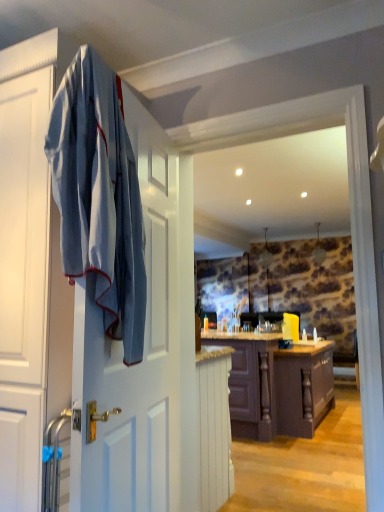
Question: Is white painted wood cabinet at lower center, the first cabinetry when ordered from left to right, facing away from blue cotton bath towel at left?

Choices:
 (A) yes
 (B) no

Answer: (B)

Question: Can you confirm if white painted wood cabinet at lower center, the 1th cabinetry from the front, is smaller than blue cotton bath towel at left?

Choices:
 (A) yes
 (B) no

Answer: (B)

Question: Does white painted wood cabinet at lower center, the 1th cabinetry from the front, have a greater width compared to blue cotton bath towel at left?

Choices:
 (A) no
 (B) yes

Answer: (A)

Question: Does white painted wood cabinet at lower center, arranged as the 2th cabinetry when viewed from the back, lie behind blue cotton bath towel at left?

Choices:
 (A) no
 (B) yes

Answer: (B)

Question: Is white painted wood cabinet at lower center, the 1th cabinetry from the front, in contact with blue cotton bath towel at left?

Choices:
 (A) no
 (B) yes

Answer: (A)

Question: Considering the relative sizes of white painted wood cabinet at lower center, the 1th cabinetry from the front, and blue cotton bath towel at left in the image provided, is white painted wood cabinet at lower center, the 1th cabinetry from the front, bigger than blue cotton bath towel at left?

Choices:
 (A) no
 (B) yes

Answer: (B)

Question: Considering the relative positions of blue cotton bath towel at left and white painted wood cabinet at lower center, the first cabinetry when ordered from left to right, in the image provided, is blue cotton bath towel at left to the left of white painted wood cabinet at lower center, the first cabinetry when ordered from left to right, from the viewer's perspective?

Choices:
 (A) no
 (B) yes

Answer: (B)

Question: Does blue cotton bath towel at left have a smaller size compared to white painted wood cabinet at lower center, the 1th cabinetry from the front?

Choices:
 (A) yes
 (B) no

Answer: (A)

Question: Does blue cotton bath towel at left come in front of white painted wood cabinet at lower center, the 1th cabinetry from the front?

Choices:
 (A) yes
 (B) no

Answer: (A)

Question: From the image's perspective, is blue cotton bath towel at left on top of white painted wood cabinet at lower center, the first cabinetry when ordered from left to right?

Choices:
 (A) no
 (B) yes

Answer: (B)

Question: Does blue cotton bath towel at left have a larger size compared to white painted wood cabinet at lower center, arranged as the 2th cabinetry when viewed from the back?

Choices:
 (A) yes
 (B) no

Answer: (B)

Question: From the image's perspective, is blue cotton bath towel at left below white painted wood cabinet at lower center, arranged as the 2th cabinetry when viewed from the right?

Choices:
 (A) yes
 (B) no

Answer: (B)

Question: Considering the relative positions of white painted wood cabinet at lower center, arranged as the 2th cabinetry when viewed from the right, and dark wood cabinet at center, marked as the 2th cabinetry in a front-to-back arrangement, in the image provided, is white painted wood cabinet at lower center, arranged as the 2th cabinetry when viewed from the right, behind dark wood cabinet at center, marked as the 2th cabinetry in a front-to-back arrangement,?

Choices:
 (A) no
 (B) yes

Answer: (A)